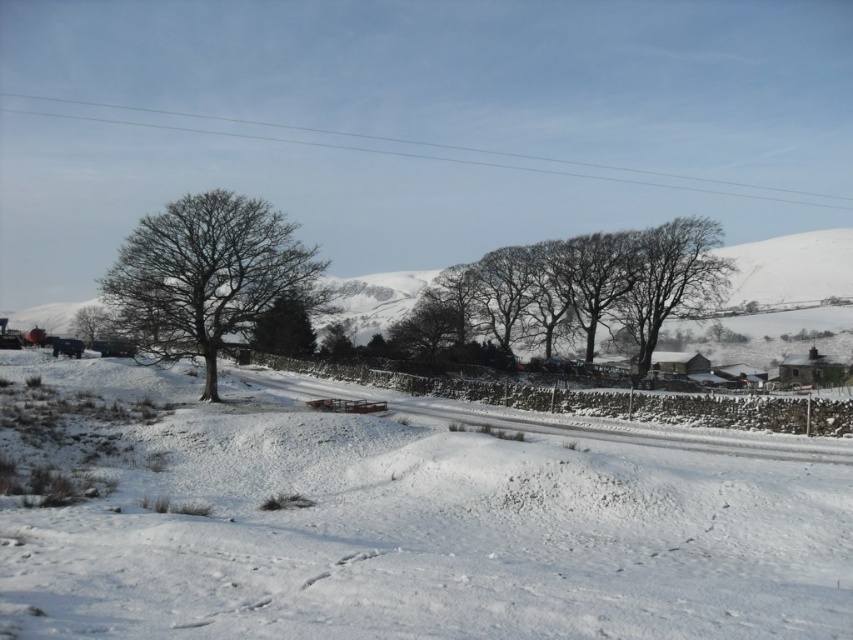
Question: Can you confirm if bare branches at center is thinner than bare wood tree at left?

Choices:
 (A) no
 (B) yes

Answer: (A)

Question: Does white powdery snow at center appear over green leafy tree at center?

Choices:
 (A) no
 (B) yes

Answer: (A)

Question: Which point is closer to the camera?

Choices:
 (A) bare wood tree at left
 (B) bare branches at center
 (C) green leafy tree at center
 (D) smooth bark tree at center

Answer: (A)

Question: Among these objects, which one is nearest to the camera?

Choices:
 (A) white powdery snow at center
 (B) bare wood tree at left

Answer: (A)

Question: Estimate the real-world distances between objects in this image. Which object is closer to the smooth bark tree at center?

Choices:
 (A) white powdery snow at center
 (B) bare branches at center
 (C) bare wood tree at left
 (D) green leafy tree at center

Answer: (B)

Question: Is bare branches at center below smooth bark tree at center?

Choices:
 (A) no
 (B) yes

Answer: (A)